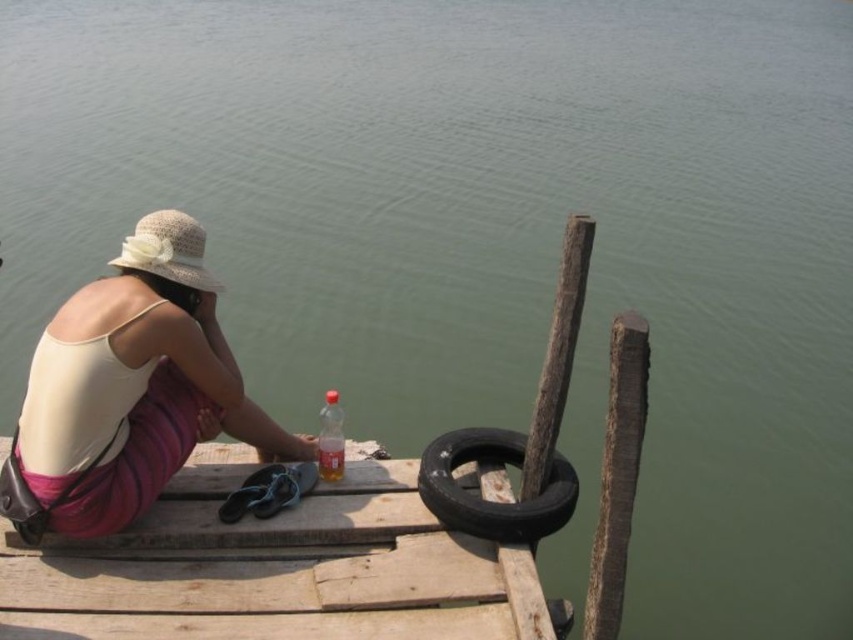
Is wooden dock at center below white woven hat at upper left?

Correct, wooden dock at center is located below white woven hat at upper left.

Does wooden dock at center have a lesser width compared to white woven hat at upper left?

In fact, wooden dock at center might be wider than white woven hat at upper left.

Who is more distant from viewer, (115, 593) or (265, 440)?

Point (265, 440)

Identify the location of wooden dock at center. (276, 568).

Is white woven hat at upper left closer to camera compared to translucent plastic bottle at lower center?

Yes, white woven hat at upper left is in front of translucent plastic bottle at lower center.

Is white woven hat at upper left further to the viewer compared to translucent plastic bottle at lower center?

No.

Identify the location of white woven hat at upper left. This screenshot has height=640, width=853. [x=134, y=385].

Between point (221, 465) and point (341, 435), which one is positioned behind?

Positioned behind is point (221, 465).

Is wooden dock at center closer to camera compared to translucent plastic bottle at lower center?

Yes, wooden dock at center is in front of translucent plastic bottle at lower center.

Which is behind, point (55, 540) or point (339, 438)?

The point (339, 438) is behind.

The height and width of the screenshot is (640, 853). In order to click on wooden dock at center in this screenshot , I will do `click(276, 568)`.